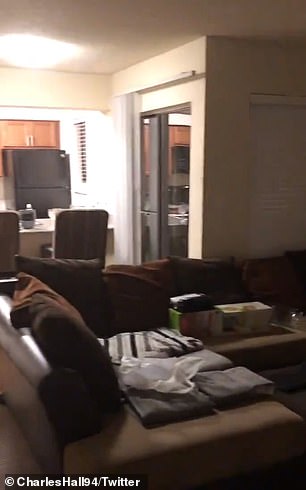
Find the location of a particular element. This screenshot has height=490, width=306. kitchen counter is located at coordinates (47, 226).